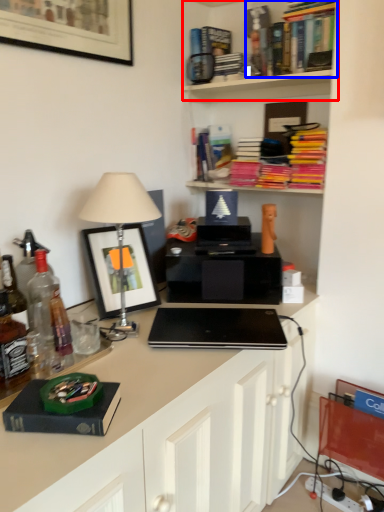
Question: Among these objects, which one is farthest to the camera, shelf (highlighted by a red box) or book (highlighted by a blue box)?

Choices:
 (A) shelf
 (B) book

Answer: (B)